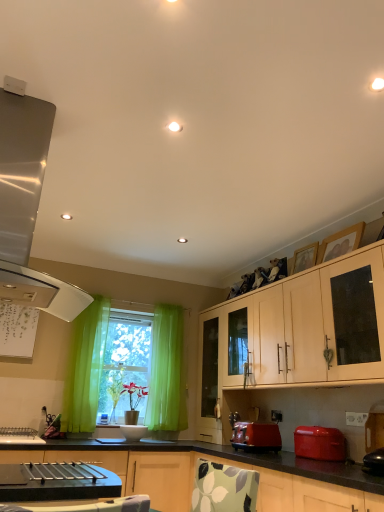
Question: From a real-world perspective, is matte red toaster at lower center positioned under green sheer curtain at window based on gravity?

Choices:
 (A) no
 (B) yes

Answer: (B)

Question: From a real-world perspective, is matte red toaster at lower center on top of green sheer curtain at window?

Choices:
 (A) no
 (B) yes

Answer: (A)

Question: Does matte red toaster at lower center come behind green sheer curtain at window?

Choices:
 (A) yes
 (B) no

Answer: (B)

Question: Can you confirm if matte red toaster at lower center is positioned to the left of green sheer curtain at window?

Choices:
 (A) yes
 (B) no

Answer: (B)

Question: Can you confirm if matte red toaster at lower center is bigger than green sheer curtain at window?

Choices:
 (A) no
 (B) yes

Answer: (A)

Question: Considering the positions of wooden picture frame at upper right, which is the 1th picture frame from back to front, and white matte cabinet at upper right, the 2th cabinetry positioned from the bottom, in the image, is wooden picture frame at upper right, which is the 1th picture frame from back to front, bigger or smaller than white matte cabinet at upper right, the 2th cabinetry positioned from the bottom,?

Choices:
 (A) big
 (B) small

Answer: (B)

Question: Do you think wooden picture frame at upper right, the second picture frame when ordered from front to back, is within white matte cabinet at upper right, which is the first cabinetry in top-to-bottom order, or outside of it?

Choices:
 (A) outside
 (B) inside

Answer: (A)

Question: From their relative heights in the image, would you say wooden picture frame at upper right, the second picture frame when ordered from front to back, is taller or shorter than white matte cabinet at upper right, the 2th cabinetry positioned from the bottom?

Choices:
 (A) short
 (B) tall

Answer: (A)

Question: Considering the positions of wooden picture frame at upper right, which is the 1th picture frame from back to front, and white matte cabinet at upper right, the 2th cabinetry positioned from the bottom, in the image, is wooden picture frame at upper right, which is the 1th picture frame from back to front, wider or thinner than white matte cabinet at upper right, the 2th cabinetry positioned from the bottom,?

Choices:
 (A) thin
 (B) wide

Answer: (A)

Question: Is white plastic power outlet at lower right taller or shorter than green sheer curtain at window?

Choices:
 (A) tall
 (B) short

Answer: (B)

Question: Looking at the image, does white plastic power outlet at lower right seem bigger or smaller compared to green sheer curtain at window?

Choices:
 (A) big
 (B) small

Answer: (B)

Question: In the image, is white plastic power outlet at lower right positioned in front of or behind green sheer curtain at window?

Choices:
 (A) behind
 (B) front

Answer: (B)

Question: Is point (276, 419) closer or farther from the camera than point (92, 393)?

Choices:
 (A) farther
 (B) closer

Answer: (B)

Question: Does point (370, 482) appear closer or farther from the camera than point (44, 135)?

Choices:
 (A) closer
 (B) farther

Answer: (A)

Question: From the image's perspective, is matte white cabinet at center, which ranks as the first cabinetry in bottom-to-top order, located above or below satin metallic range hood at left?

Choices:
 (A) below
 (B) above

Answer: (A)